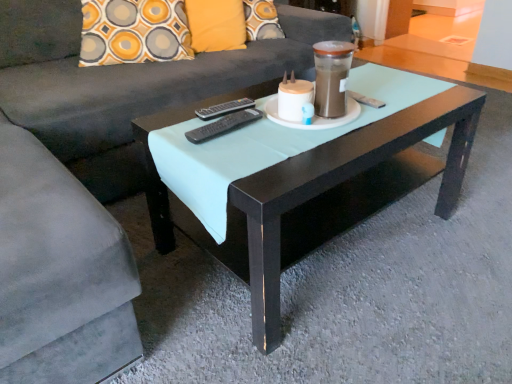
This screenshot has width=512, height=384. I want to click on vacant space situated on the left part of black plastic remote at center, which is counted as the second remote, starting from the back, so click(178, 130).